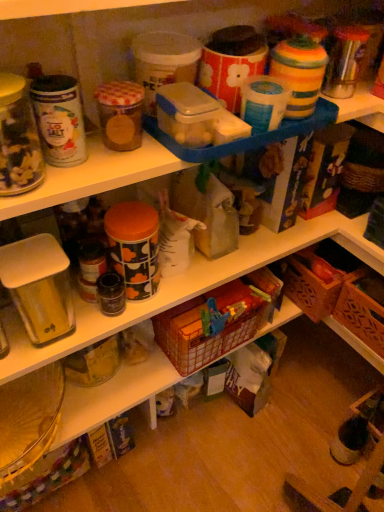
Question: Considering the relative positions of brown woven basket at lower right, arranged as the 2th basket when viewed from the left, and plastic woven basket at center, the second basket when ordered from right to left, in the image provided, is brown woven basket at lower right, arranged as the 2th basket when viewed from the left, to the left or to the right of plastic woven basket at center, the second basket when ordered from right to left,?

Choices:
 (A) left
 (B) right

Answer: (B)

Question: Is brown woven basket at lower right, arranged as the 2th basket when viewed from the left, inside the boundaries of plastic woven basket at center, the second basket when ordered from right to left, or outside?

Choices:
 (A) inside
 (B) outside

Answer: (B)

Question: Considering the positions of brown woven basket at lower right, positioned as the 1th basket in right-to-left order, and plastic woven basket at center, the second basket when ordered from right to left, in the image, is brown woven basket at lower right, positioned as the 1th basket in right-to-left order, taller or shorter than plastic woven basket at center, the second basket when ordered from right to left,?

Choices:
 (A) tall
 (B) short

Answer: (B)

Question: From the image's perspective, is plastic woven basket at center, marked as the first basket in a left-to-right arrangement, positioned above or below brown woven basket at lower right, positioned as the 1th basket in right-to-left order?

Choices:
 (A) above
 (B) below

Answer: (B)

Question: In terms of size, does plastic woven basket at center, marked as the first basket in a left-to-right arrangement, appear bigger or smaller than brown woven basket at lower right, positioned as the 1th basket in right-to-left order?

Choices:
 (A) small
 (B) big

Answer: (B)

Question: From a real-world perspective, relative to brown woven basket at lower right, positioned as the 1th basket in right-to-left order, is plastic woven basket at center, the second basket when ordered from right to left, vertically above or below?

Choices:
 (A) above
 (B) below

Answer: (A)

Question: From their relative heights in the image, would you say plastic woven basket at center, marked as the first basket in a left-to-right arrangement, is taller or shorter than brown woven basket at lower right, arranged as the 2th basket when viewed from the left?

Choices:
 (A) tall
 (B) short

Answer: (A)